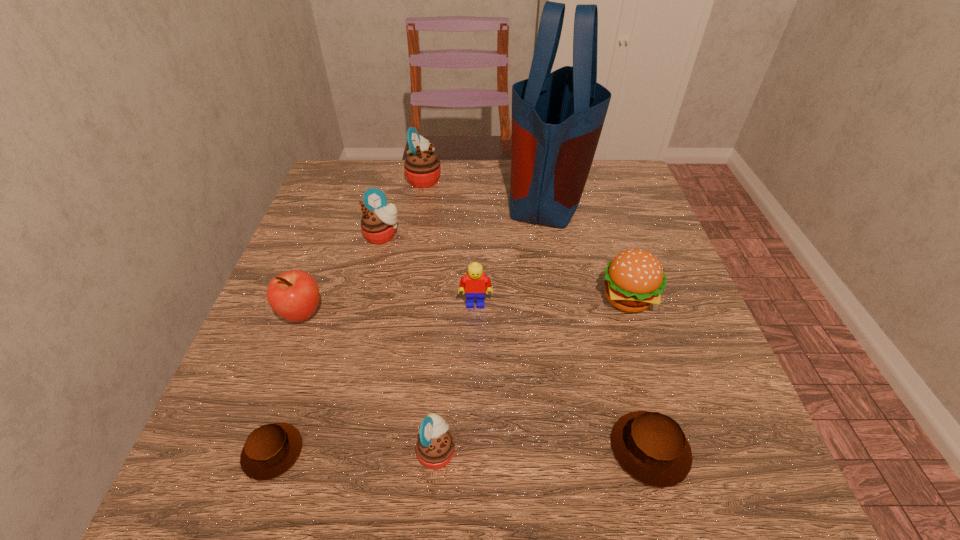
In order to click on handbag in this screenshot , I will do `click(557, 117)`.

The image size is (960, 540). I want to click on red handbag, so click(x=557, y=117).

You are a GUI agent. You are given a task and a screenshot of the screen. Output one action in this format:
    pyautogui.click(x=<x>, y=<y>)
    Task: Click on the eighth shortest object
    
    Given the screenshot: What is the action you would take?
    pyautogui.click(x=422, y=167)

I want to click on the tallest muffin, so click(422, 167).

What are the coordinates of `the second biggest pink muffin` in the screenshot? It's located at (x=378, y=224).

Identify the location of the second farthest pink muffin. The height and width of the screenshot is (540, 960). (378, 224).

The width and height of the screenshot is (960, 540). What are the coordinates of `hamburger` in the screenshot? It's located at (634, 279).

Where is `apple`? This screenshot has height=540, width=960. apple is located at coordinates (294, 295).

Locate an element on the screen. yellow Lego is located at coordinates (475, 282).

At what (x,y) coordinates should I click in order to perform the action: click on the smallest pink muffin. Please return your answer as a coordinate pair (x, y). The width and height of the screenshot is (960, 540). Looking at the image, I should click on point(435,446).